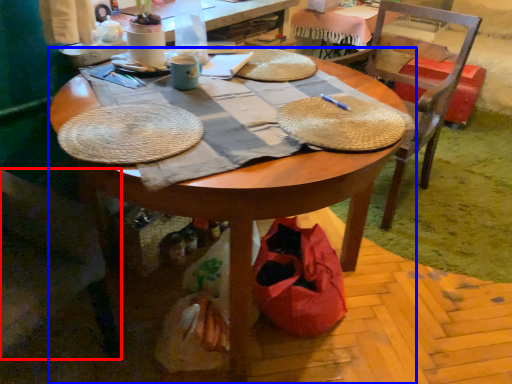
Question: Which point is closer to the camera, chair (highlighted by a red box) or desk (highlighted by a blue box)?

Choices:
 (A) chair
 (B) desk

Answer: (B)